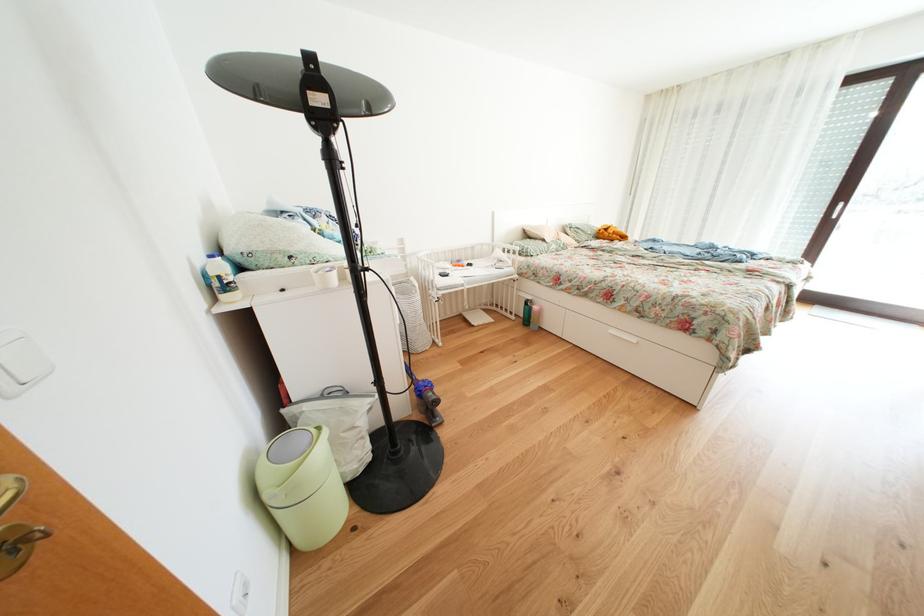
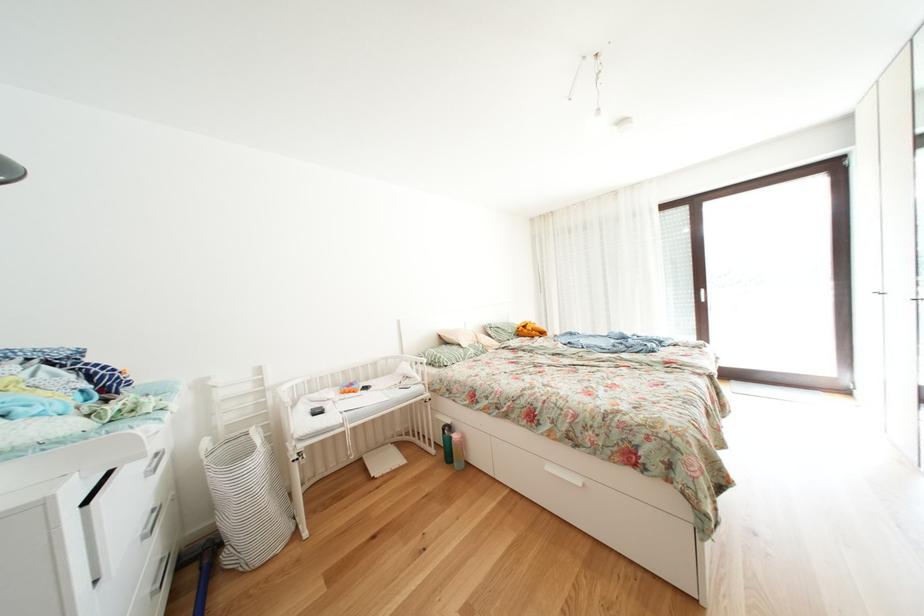
Question: The first image is from the beginning of the video and the second image is from the end. How did the camera likely rotate when shooting the video?

Choices:
 (A) Left
 (B) Right
 (C) Up
 (D) Down

Answer: (C)